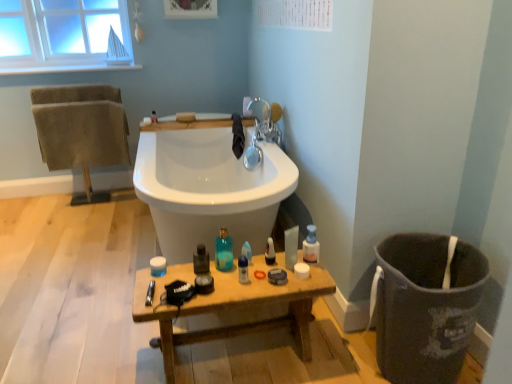
The width and height of the screenshot is (512, 384). In order to click on vacant space in between translucent plastic container at center, the second toiletry when ordered from left to right, and translucent glass mouthwash at center, which is counted as the first mouthwash, starting from the left in this screenshot , I will do `click(181, 269)`.